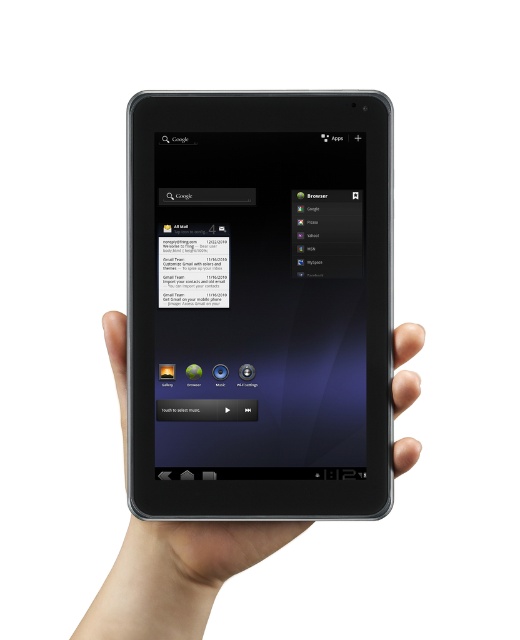
Question: Can you confirm if black matte tablet at center is wider than smooth skin hand at center?

Choices:
 (A) no
 (B) yes

Answer: (A)

Question: Among these points, which one is nearest to the camera?

Choices:
 (A) (134, 532)
 (B) (380, 406)

Answer: (B)

Question: Can you confirm if black matte tablet at center is positioned below smooth skin hand at center?

Choices:
 (A) no
 (B) yes

Answer: (A)

Question: Which object is closer to the camera taking this photo?

Choices:
 (A) smooth skin hand at center
 (B) black matte tablet at center

Answer: (A)

Question: Can you confirm if black matte tablet at center is thinner than smooth skin hand at center?

Choices:
 (A) yes
 (B) no

Answer: (A)